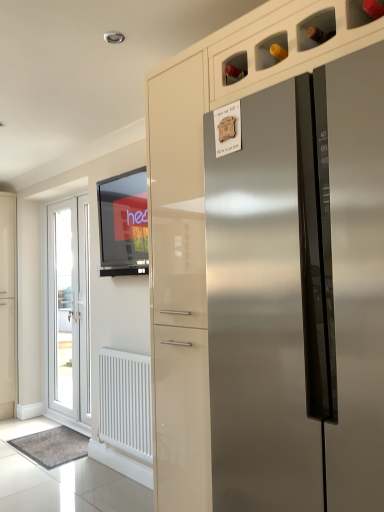
What is the approximate height of matte black tv at upper left?

matte black tv at upper left is 67.46 centimeters tall.

Identify the location of white glossy door at left. pos(68,310).

From a real-world perspective, is white glossy door at left physically above stainless steel refrigerator at center?

Result: No, from a real-world perspective, white glossy door at left is not on top of stainless steel refrigerator at center.

From the image's perspective, would you say white glossy door at left is positioned over stainless steel refrigerator at center?

No, from the image's perspective, white glossy door at left is not above stainless steel refrigerator at center.

How many degrees apart are the facing directions of white glossy door at left and stainless steel refrigerator at center?

The facing directions of white glossy door at left and stainless steel refrigerator at center are 2.68 degrees apart.

Can we say white glossy door at left lies outside stainless steel refrigerator at center?

Yes, white glossy door at left is outside of stainless steel refrigerator at center.

Which object is wider, matte black tv at upper left or stainless steel refrigerator at center?

Wider between the two is stainless steel refrigerator at center.

Can you tell me how much matte black tv at upper left and stainless steel refrigerator at center differ in facing direction?

There is a 2.68-degree angle between the facing directions of matte black tv at upper left and stainless steel refrigerator at center.

At what (x,y) coordinates should I click in order to perform the action: click on refrigerator in front of the matte black tv at upper left. Please return your answer as a coordinate pair (x, y). Looking at the image, I should click on (258, 316).

From a real-world perspective, is matte black tv at upper left under stainless steel refrigerator at center?

No.

Who is shorter, stainless steel refrigerator at center or white matte radiator at lower left?

white matte radiator at lower left is shorter.

Locate an element on the screen. The height and width of the screenshot is (512, 384). radiator on the left of stainless steel refrigerator at center is located at coordinates (126, 402).

Which of these two, stainless steel refrigerator at center or white matte radiator at lower left, is wider?

With larger width is stainless steel refrigerator at center.

Between stainless steel refrigerator at center and white matte radiator at lower left, which one has smaller size?

white matte radiator at lower left.

Is white glossy door at left facing away from white matte radiator at lower left?

No.

Considering the relative positions of white glossy door at left and white matte radiator at lower left in the image provided, is white glossy door at left to the left or to the right of white matte radiator at lower left?

From the image, it's evident that white glossy door at left is to the left of white matte radiator at lower left.

Would you consider white matte radiator at lower left to be distant from white glossy door at left?

Yes, white matte radiator at lower left and white glossy door at left are quite far apart.

Considering the relative sizes of white matte radiator at lower left and white glossy door at left in the image provided, is white matte radiator at lower left bigger than white glossy door at left?

No.

What's the angular difference between white matte radiator at lower left and white glossy door at left's facing directions?

The facing directions of white matte radiator at lower left and white glossy door at left are 0.735 degrees apart.

Could you tell me if stainless steel refrigerator at center is facing white glossy door at left?

No, stainless steel refrigerator at center is not aimed at white glossy door at left.

From the image's perspective, does stainless steel refrigerator at center appear higher than white glossy door at left?

Indeed, from the image's perspective, stainless steel refrigerator at center is shown above white glossy door at left.

Which object is closer to the camera, stainless steel refrigerator at center or white glossy door at left?

stainless steel refrigerator at center is in front.

Looking at this image, does white glossy door at left have a greater height compared to matte black tv at upper left?

Yes.

Is white glossy door at left surrounding matte black tv at upper left?

No, matte black tv at upper left is located outside of white glossy door at left.

From the image's perspective, is white glossy door at left located above matte black tv at upper left?

Actually, white glossy door at left appears below matte black tv at upper left in the image.

Considering the sizes of objects white glossy door at left and matte black tv at upper left in the image provided, who is bigger, white glossy door at left or matte black tv at upper left?

With larger size is white glossy door at left.

This screenshot has height=512, width=384. Find the location of `refrigerator above the white glossy door at left (from the image's perspective)`. refrigerator above the white glossy door at left (from the image's perspective) is located at coordinates click(258, 316).

This screenshot has width=384, height=512. There is a stainless steel refrigerator at center. Find the location of `window screen above it (from a real-world perspective)`. window screen above it (from a real-world perspective) is located at coordinates (123, 224).

Considering their positions, is matte black tv at upper left positioned closer to white glossy door at left than white matte radiator at lower left?

Among the two, matte black tv at upper left is located nearer to white glossy door at left.

Based on their spatial positions, is white glossy door at left or stainless steel refrigerator at center closer to matte black tv at upper left?

The object closer to matte black tv at upper left is white glossy door at left.

Looking at the image, which one is located further to white glossy door at left, matte black tv at upper left or stainless steel refrigerator at center?

stainless steel refrigerator at center is positioned further to the anchor white glossy door at left.

When comparing their distances from stainless steel refrigerator at center, does white matte radiator at lower left or white glossy door at left seem closer?

white matte radiator at lower left.

From the image, which object appears to be farther from matte black tv at upper left, white matte radiator at lower left or stainless steel refrigerator at center?

The object further to matte black tv at upper left is stainless steel refrigerator at center.

From the picture: Looking at the image, which one is located closer to white matte radiator at lower left, stainless steel refrigerator at center or white glossy door at left?

white glossy door at left is positioned closer to the anchor white matte radiator at lower left.

From the image, which object appears to be nearer to stainless steel refrigerator at center, white matte radiator at lower left or matte black tv at upper left?

matte black tv at upper left is closer to stainless steel refrigerator at center.

Which object lies nearer to the anchor point matte black tv at upper left, stainless steel refrigerator at center or white glossy door at left?

white glossy door at left lies closer to matte black tv at upper left than the other object.

At what (x,y) coordinates should I click in order to perform the action: click on window screen located between stainless steel refrigerator at center and white glossy door at left in the depth direction. Please return your answer as a coordinate pair (x, y). Image resolution: width=384 pixels, height=512 pixels. Looking at the image, I should click on (123, 224).

Find the location of `window screen located between white matte radiator at lower left and white glossy door at left in the depth direction`. window screen located between white matte radiator at lower left and white glossy door at left in the depth direction is located at coordinates (123, 224).

Locate an element on the screen. This screenshot has width=384, height=512. radiator between stainless steel refrigerator at center and white glossy door at left in the front-back direction is located at coordinates (126, 402).

You are a GUI agent. You are given a task and a screenshot of the screen. Output one action in this format:
    pyautogui.click(x=<x>, y=<y>)
    Task: Click on the radiator located between stainless steel refrigerator at center and matte black tv at upper left in the depth direction
    
    Given the screenshot: What is the action you would take?
    pyautogui.click(x=126, y=402)